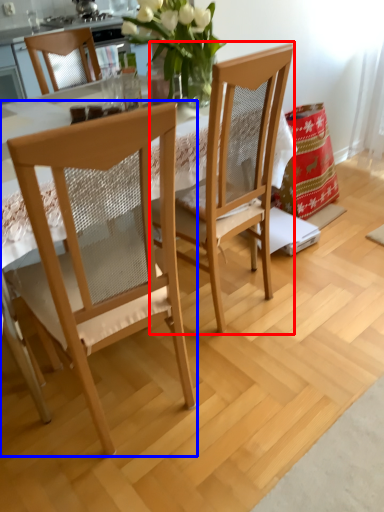
Question: Which object is further to the camera taking this photo, chair (highlighted by a red box) or chair (highlighted by a blue box)?

Choices:
 (A) chair
 (B) chair

Answer: (A)